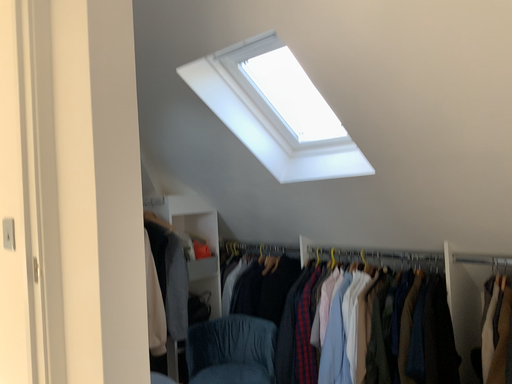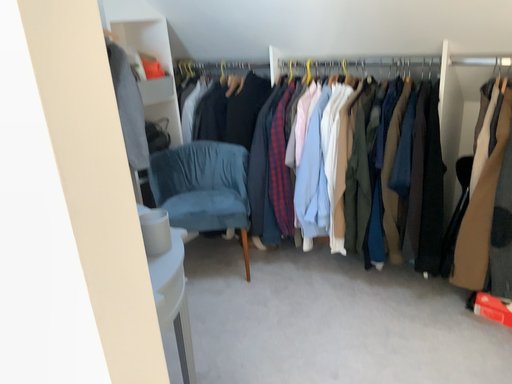
Question: How did the camera likely rotate when shooting the video?

Choices:
 (A) rotated upward
 (B) rotated downward

Answer: (B)